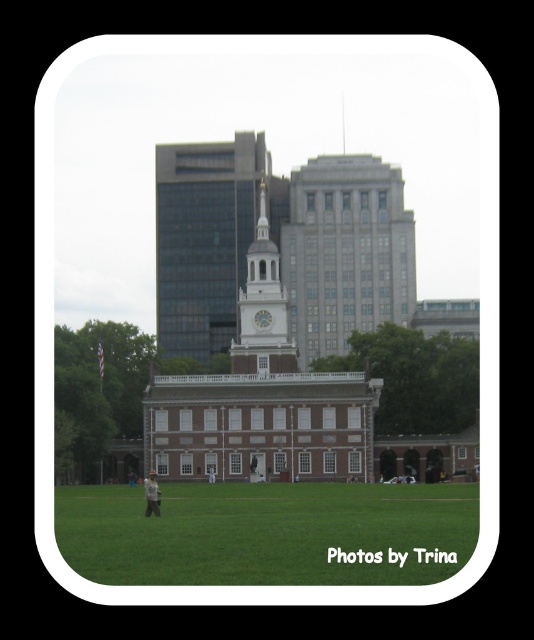
Which of these two, white brick tower at center or white glossy clock at center, stands shorter?

With less height is white glossy clock at center.

Is point (214, 346) more distant than point (263, 324)?

That is True.

Which is in front, point (200, 330) or point (255, 314)?

Positioned in front is point (255, 314).

Locate an element on the screen. The width and height of the screenshot is (534, 640). white brick tower at center is located at coordinates (208, 237).

Can you confirm if white brick tower at center is wider than white painted wood clock tower at center?

Yes, white brick tower at center is wider than white painted wood clock tower at center.

Who is more forward, (171, 266) or (233, 362)?

Positioned in front is point (233, 362).

Who is more distant from viewer, (245,246) or (270,301)?

The point (245,246) is more distant.

This screenshot has height=640, width=534. In order to click on white brick tower at center in this screenshot , I will do `click(208, 237)`.

Which of these two, gray stone clock tower at center or brown leather jacket at center, stands taller?

Standing taller between the two is gray stone clock tower at center.

Where is `gray stone clock tower at center`? The image size is (534, 640). gray stone clock tower at center is located at coordinates (343, 250).

Where is `gray stone clock tower at center`? This screenshot has width=534, height=640. gray stone clock tower at center is located at coordinates (343, 250).